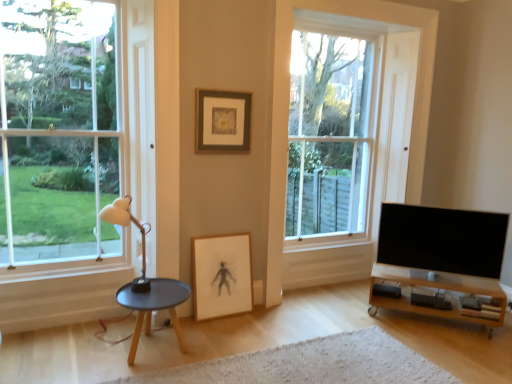
What do you see at coordinates (311, 364) in the screenshot? I see `white textured rug at lower center` at bounding box center [311, 364].

This screenshot has height=384, width=512. What do you see at coordinates (221, 275) in the screenshot?
I see `wooden framed drawing at center, which appears as the 2th picture frame when viewed from the top` at bounding box center [221, 275].

In order to face black glossy tv at lower right, should I rotate leftwards or rightwards?

Rotate right and turn 23.421 degrees.

Locate an element on the screen. clear glass window at center, the first window when ordered from right to left is located at coordinates (353, 115).

Is point (348, 146) behind point (158, 302)?

Yes, it is behind point (158, 302).

Considering the positions of objects clear glass window at center, the first window when ordered from right to left, and matte black table at lower left in the image provided, who is more to the left, clear glass window at center, the first window when ordered from right to left, or matte black table at lower left?

From the viewer's perspective, matte black table at lower left appears more on the left side.

From the image's perspective, which one is positioned lower, clear glass window at center, the first window when ordered from right to left, or matte black table at lower left?

matte black table at lower left.

The height and width of the screenshot is (384, 512). Find the location of `coffee table lying in front of the clear glass window at center, which is the 2th window from left to right`. coffee table lying in front of the clear glass window at center, which is the 2th window from left to right is located at coordinates (154, 306).

Choose the correct answer: Is matte black table at lower left inside clear glass window at left, which is the 2th window from back to front, or outside it?

matte black table at lower left exists outside the volume of clear glass window at left, which is the 2th window from back to front.

Is matte black table at lower left directly adjacent to clear glass window at left, which is counted as the first window, starting from the left?

matte black table at lower left is not next to clear glass window at left, which is counted as the first window, starting from the left, and they're not touching.

From the image's perspective, between matte black table at lower left and clear glass window at left, the 1th window positioned from the front, who is located below?

matte black table at lower left.

Can you confirm if matte black table at lower left is shorter than clear glass window at left, the 1th window positioned from the front?

Correct, matte black table at lower left is not as tall as clear glass window at left, the 1th window positioned from the front.

Based on their sizes in the image, would you say white textured rug at lower center is bigger or smaller than white matte lamp at left?

Clearly, white textured rug at lower center is smaller in size than white matte lamp at left.

Which object is closer to the camera taking this photo, white textured rug at lower center or white matte lamp at left?

Positioned in front is white textured rug at lower center.

From a real-world perspective, which is physically below, white textured rug at lower center or white matte lamp at left?

white textured rug at lower center is physically lower.

Is point (151, 379) behind point (126, 216)?

That is True.

Consider the image. Relative to clear glass window at center, the first window when ordered from right to left, is white textured rug at lower center in front or behind?

white textured rug at lower center is in front of clear glass window at center, the first window when ordered from right to left.

Is white textured rug at lower center placed right next to clear glass window at center, the 2th window positioned from the front?

No, white textured rug at lower center is not in contact with clear glass window at center, the 2th window positioned from the front.

Is white textured rug at lower center oriented towards clear glass window at center, the first window when ordered from right to left?

No, white textured rug at lower center is not oriented towards clear glass window at center, the first window when ordered from right to left.

Is point (201, 377) positioned after point (8, 50)?

No, (201, 377) is closer to viewer.

Is white textured rug at lower center inside or outside of clear glass window at left, which is the 2th window from back to front?

white textured rug at lower center is not inside clear glass window at left, which is the 2th window from back to front, it's outside.

How much distance is there between white textured rug at lower center and clear glass window at left, which is the 2th window from back to front?

white textured rug at lower center is 5.89 feet away from clear glass window at left, which is the 2th window from back to front.

Can you confirm if white textured rug at lower center is positioned to the left of clear glass window at left, which is counted as the first window, starting from the left?

No, white textured rug at lower center is not to the left of clear glass window at left, which is counted as the first window, starting from the left.

Choose the correct answer: Is black glossy tv at lower right inside matte black picture frame at upper center, the 2th picture frame ordered from the bottom, or outside it?

black glossy tv at lower right is spatially situated outside matte black picture frame at upper center, the 2th picture frame ordered from the bottom.

From a real-world perspective, relative to matte black picture frame at upper center, acting as the first picture frame starting from the top, is black glossy tv at lower right vertically above or below?

Clearly, from a real-world perspective, black glossy tv at lower right is below matte black picture frame at upper center, acting as the first picture frame starting from the top.

Consider the image. Which of these two, black glossy tv at lower right or matte black picture frame at upper center, the 2th picture frame ordered from the bottom, is smaller?

With smaller size is matte black picture frame at upper center, the 2th picture frame ordered from the bottom.

Relative to matte black picture frame at upper center, acting as the first picture frame starting from the top, is white textured rug at lower center in front or behind?

white textured rug at lower center is in front of matte black picture frame at upper center, acting as the first picture frame starting from the top.

Is point (360, 380) positioned before point (199, 112)?

Yes, it is in front of point (199, 112).

From the image's perspective, does white textured rug at lower center appear higher than matte black picture frame at upper center, acting as the first picture frame starting from the top?

No, from the image's perspective, white textured rug at lower center is not above matte black picture frame at upper center, acting as the first picture frame starting from the top.

Is white textured rug at lower center not inside matte black picture frame at upper center, the 2th picture frame ordered from the bottom?

Yes.

At what (x,y) coordinates should I click in order to perform the action: click on coffee table below the clear glass window at center, which is counted as the 1th window, starting from the back (from a real-world perspective). Please return your answer as a coordinate pair (x, y). Looking at the image, I should click on (154, 306).

The image size is (512, 384). In order to click on window that is the 1st one when counting backward from the matte black table at lower left in this screenshot , I will do `click(58, 130)`.

Estimate the real-world distances between objects in this image. Which object is further from white textured rug at lower center, clear glass window at center, the 2th window positioned from the front, or black glossy tv at lower right?

Based on the image, clear glass window at center, the 2th window positioned from the front, appears to be further to white textured rug at lower center.

Based on the photo, considering their positions, is white textured rug at lower center positioned closer to clear glass window at center, which is the 2th window from left to right, than clear glass window at left, the 1th window positioned from the front?

The object closer to clear glass window at center, which is the 2th window from left to right, is white textured rug at lower center.

Looking at the image, which one is located further to white matte lamp at left, wooden tv stand at lower right or clear glass window at center, which is counted as the 1th window, starting from the back?

Among the two, wooden tv stand at lower right is located further to white matte lamp at left.

Which object lies nearer to the anchor point wooden tv stand at lower right, clear glass window at center, which is the 2th window from left to right, or clear glass window at left, the 1th window positioned from the front?

The object closer to wooden tv stand at lower right is clear glass window at center, which is the 2th window from left to right.

Based on their spatial positions, is white matte lamp at left or clear glass window at center, the first window when ordered from right to left, closer to white textured rug at lower center?

Among the two, white matte lamp at left is located nearer to white textured rug at lower center.

Which object lies further to the anchor point matte black picture frame at upper center, acting as the first picture frame starting from the top, clear glass window at left, which is the 2th window from back to front, or white matte lamp at left?

The object further to matte black picture frame at upper center, acting as the first picture frame starting from the top, is clear glass window at left, which is the 2th window from back to front.

Based on their spatial positions, is clear glass window at left, which is the 2th window from back to front, or wooden framed drawing at center, which appears as the 2th picture frame when viewed from the top, closer to wooden tv stand at lower right?

wooden framed drawing at center, which appears as the 2th picture frame when viewed from the top, lies closer to wooden tv stand at lower right than the other object.

When comparing their distances from black glossy tv at lower right, does wooden framed drawing at center, which appears as the 2th picture frame when viewed from the top, or white textured rug at lower center seem further?

Among the two, wooden framed drawing at center, which appears as the 2th picture frame when viewed from the top, is located further to black glossy tv at lower right.

You are a GUI agent. You are given a task and a screenshot of the screen. Output one action in this format:
    pyautogui.click(x=<x>, y=<y>)
    Task: Click on the coffee table between white matte lamp at left and clear glass window at center, which is the 2th window from left to right, in the horizontal direction
    The height and width of the screenshot is (384, 512).
    Given the screenshot: What is the action you would take?
    pyautogui.click(x=154, y=306)

Image resolution: width=512 pixels, height=384 pixels. In order to click on lamp between matte black picture frame at upper center, acting as the first picture frame starting from the top, and matte black table at lower left, in the vertical direction in this screenshot , I will do `click(126, 225)`.

Locate an element on the screen. window between matte black table at lower left and wooden tv stand at lower right is located at coordinates (353, 115).

Identify the location of picture frame located between wooden framed drawing at center, which appears as the 2th picture frame when viewed from the top, and black glossy tv at lower right in the left-right direction. (222, 122).